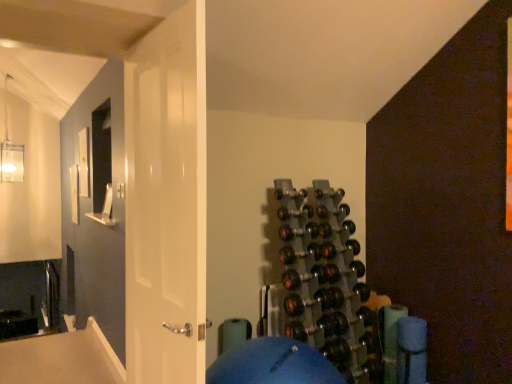
Question: Considering the positions of metallic gray wine rack at center-right and white glossy door at center in the image, is metallic gray wine rack at center-right taller or shorter than white glossy door at center?

Choices:
 (A) short
 (B) tall

Answer: (A)

Question: In the image, is metallic gray wine rack at center-right positioned in front of or behind white glossy door at center?

Choices:
 (A) front
 (B) behind

Answer: (B)

Question: Is metallic gray wine rack at center-right wider or thinner than white glossy door at center?

Choices:
 (A) wide
 (B) thin

Answer: (A)

Question: In terms of width, does white glossy door at center look wider or thinner when compared to metallic gray wine rack at center-right?

Choices:
 (A) wide
 (B) thin

Answer: (B)

Question: Considering their positions, is white glossy door at center located in front of or behind metallic gray wine rack at center-right?

Choices:
 (A) front
 (B) behind

Answer: (A)

Question: Considering the positions of point (168, 51) and point (308, 309), is point (168, 51) closer or farther from the camera than point (308, 309)?

Choices:
 (A) closer
 (B) farther

Answer: (A)

Question: Do you think white glossy door at center is within metallic gray wine rack at center-right, or outside of it?

Choices:
 (A) outside
 (B) inside

Answer: (A)